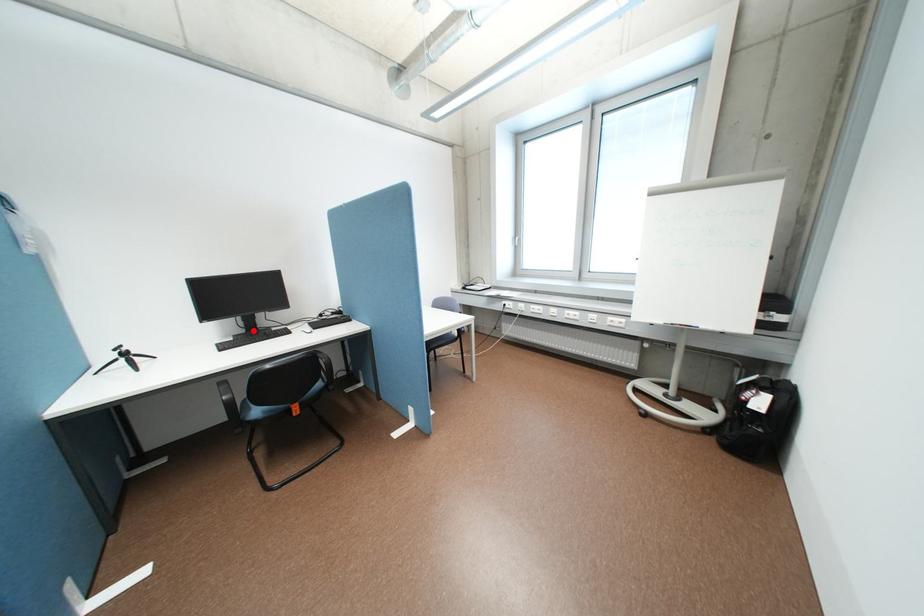
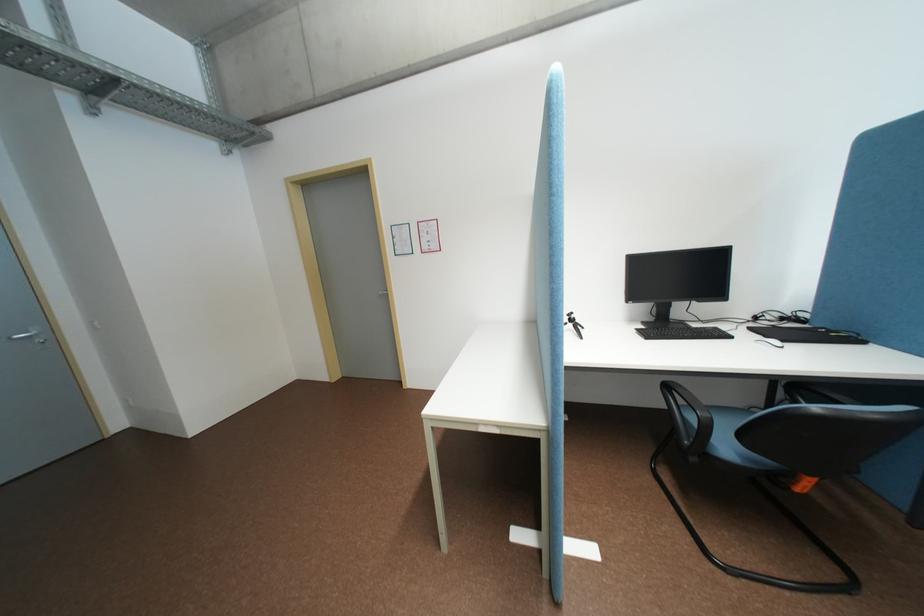
The point at the highlighted location is marked in the first image. Where is the corresponding point in the second image?

(662, 318)